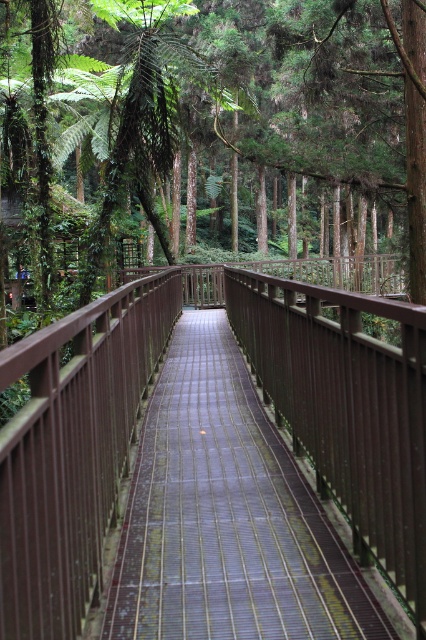
You are a hiker standing on the brown wooden bridge at center and want to reach the brown wooden rail at center. Which direction should you move to get closer to the rail?

You should move forward towards the brown wooden rail at center because the brown wooden bridge at center is further away from you than the rail, so moving toward it would bring you closer.

You are standing on the wooden walkway bridge and want to take a photo of the green leafy forest at center and the brown wooden rail at center. Which object should you point your camera towards first if you want to capture both in a single shot from your current position?

You should point your camera towards the green leafy forest at center first since it is to the left of the brown wooden rail at center, allowing both to be captured in the frame.

You are a hiker carrying a large backpack and need to cross the brown wooden bridge at center. The bridge has a brown wooden rail at center on either side. Considering the height of the rail, will you be able to comfortably stand upright while crossing the bridge?

The brown wooden rail at center is taller than the brown wooden bridge at center, so you can comfortably stand upright while crossing the bridge since the rail provides sufficient height for support.